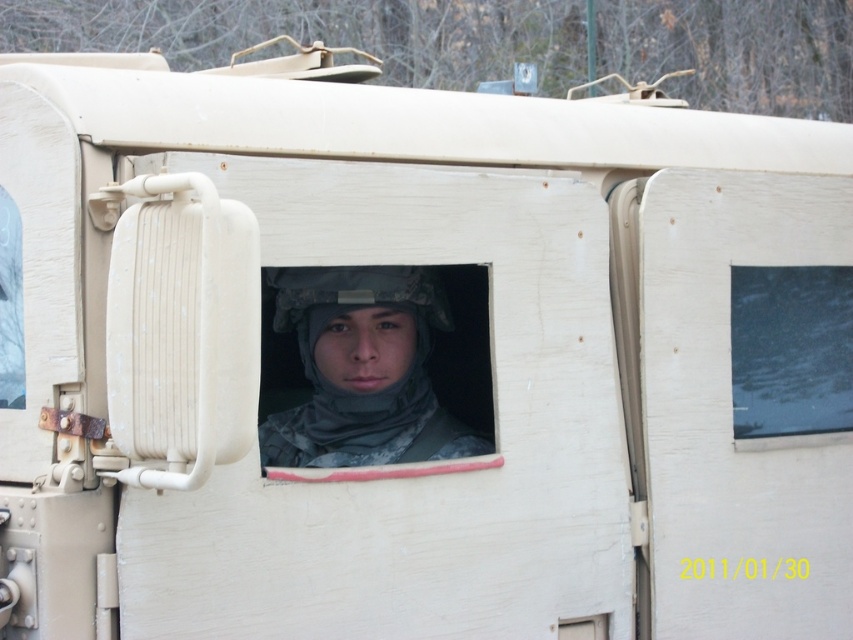
You are a soldier inside the Humvee. You notice a point marked at coordinates (x=363, y=369). What object is located at that point?

The camouflage fabric helmet at center is located at point (x=363, y=369).

Based on the photo, you are a soldier inside the Humvee and want to check the rearview mirror on the left side of the transparent glass window at center. Can you see the camouflage fabric helmet at center in the mirror?

The camouflage fabric helmet at center is below the transparent glass window at center, so the mirror attached to the left side of the window would reflect the area above the window. Since the helmet is below the window, it would not be visible in the mirror.

You are standing outside the Humvee and want to throw a small object to a friend who is at point (422,266) inside the vehicle. If the maximum distance you can throw is 12 feet, will you be able to reach them?

The distance between you and the point (422,266) is 11.87 feet, which is within your throwing range of 12 feet. Yes, you can reach them.